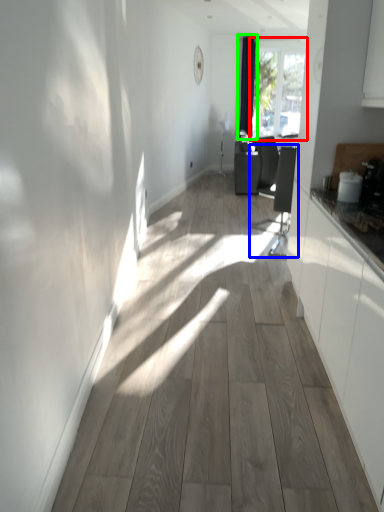
Question: Estimate the real-world distances between objects in this image. Which object is farther from window (highlighted by a red box), swivel chair (highlighted by a blue box) or curtain (highlighted by a green box)?

Choices:
 (A) swivel chair
 (B) curtain

Answer: (A)